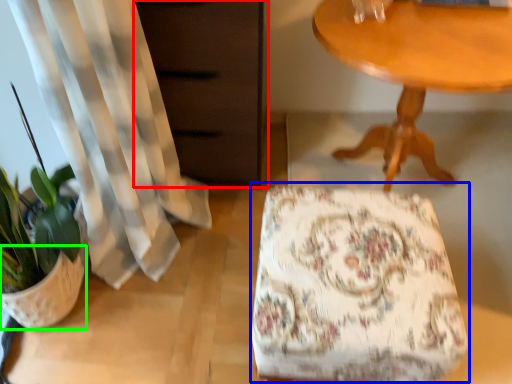
Question: Estimate the real-world distances between objects in this image. Which object is farther from dresser (highlighted by a red box), rocking chair (highlighted by a blue box) or flowerpot (highlighted by a green box)?

Choices:
 (A) rocking chair
 (B) flowerpot

Answer: (B)